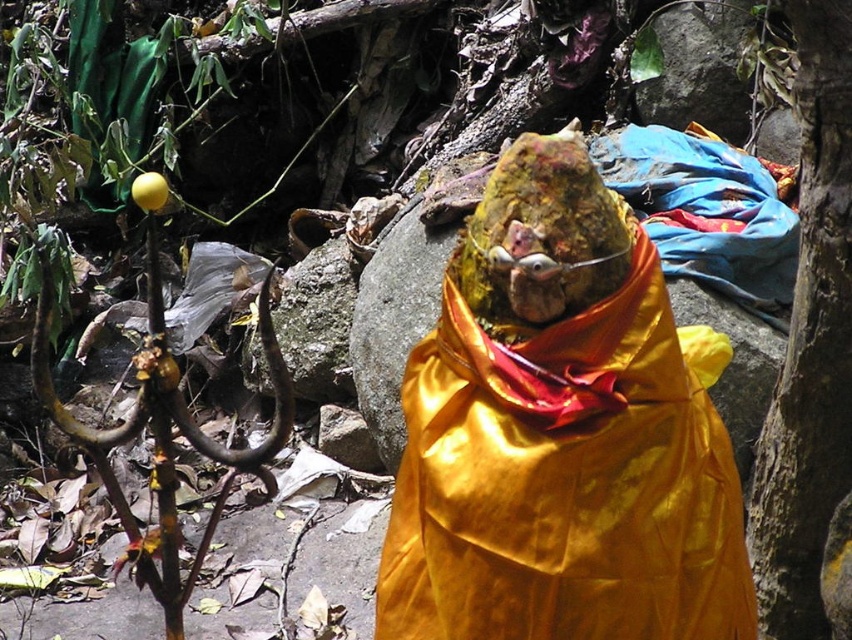
Measure the distance between shiny gold statue at center and smooth brown bark at right.

A distance of 24.47 inches exists between shiny gold statue at center and smooth brown bark at right.

Consider the image. Which of these two, shiny gold statue at center or smooth brown bark at right, stands shorter?

With less height is shiny gold statue at center.

Who is more forward, (573, 257) or (775, 483)?

Point (573, 257) is in front.

You are a GUI agent. You are given a task and a screenshot of the screen. Output one action in this format:
    pyautogui.click(x=<x>, y=<y>)
    Task: Click on the shiny gold statue at center
    The image size is (852, 640).
    Given the screenshot: What is the action you would take?
    pyautogui.click(x=562, y=433)